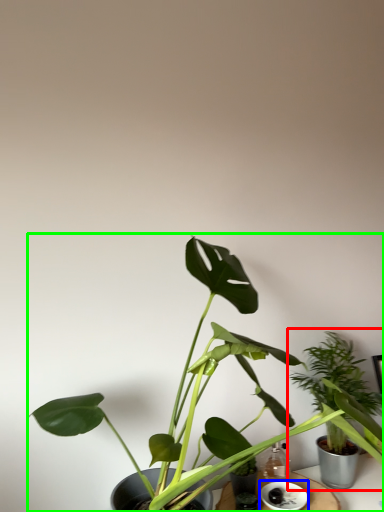
Question: Which is nearer to the houseplant (highlighted by a red box)? saucer (highlighted by a blue box) or houseplant (highlighted by a green box).

Choices:
 (A) saucer
 (B) houseplant

Answer: (B)